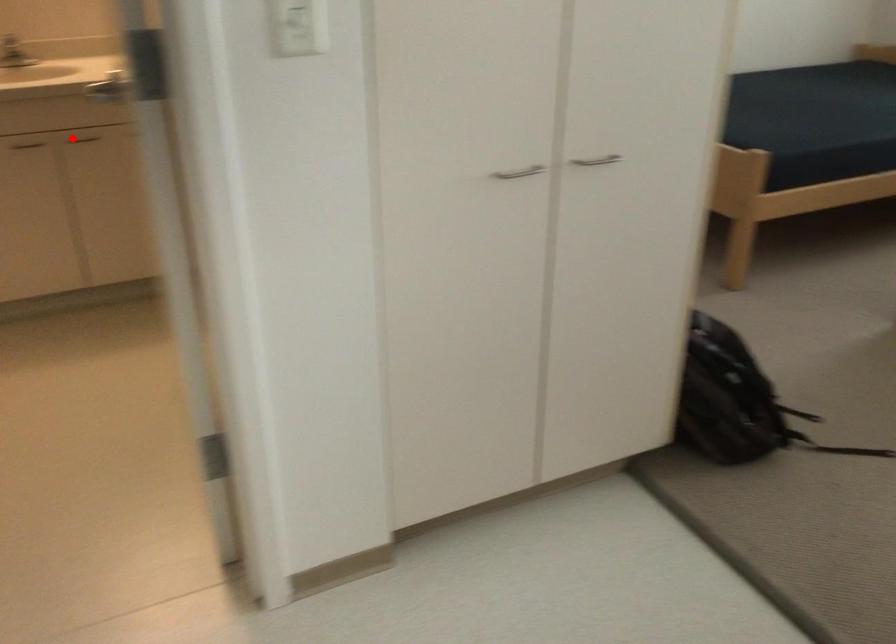
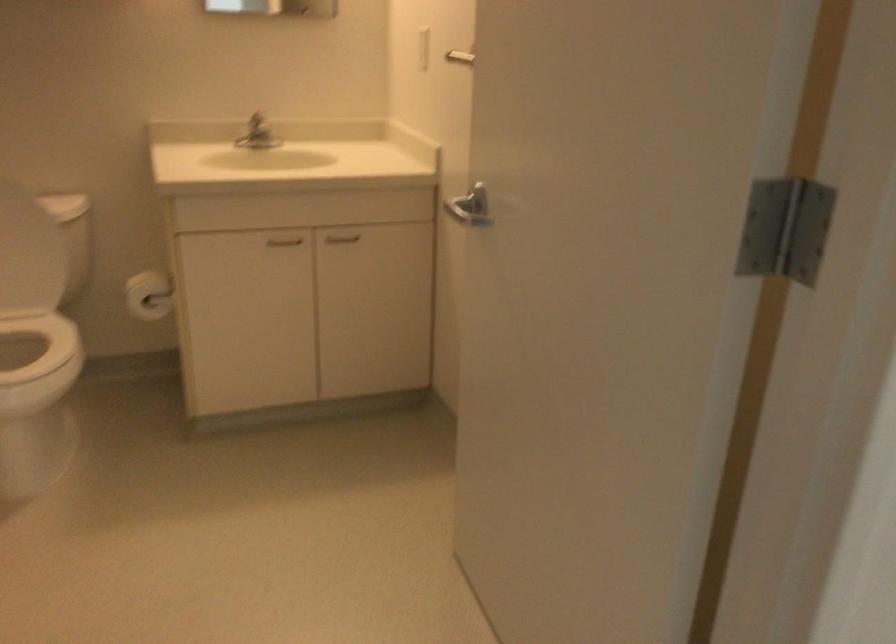
Question: A red point is marked in image1. In image2, is the corresponding 3D point closer to the camera or farther? Reply with the corresponding letter.

Choices:
 (A) The corresponding 3D point is closer.
 (B) The corresponding 3D point is farther.

Answer: (A)